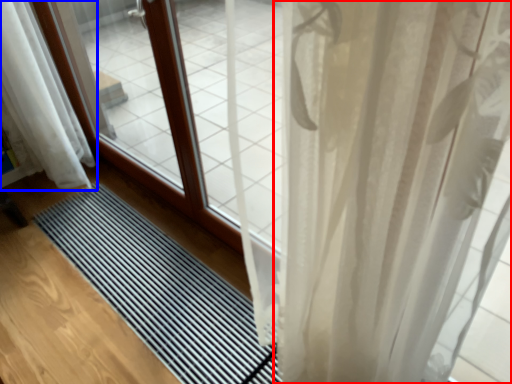
Question: Which object appears farthest to the camera in this image, curtain (highlighted by a red box) or curtain (highlighted by a blue box)?

Choices:
 (A) curtain
 (B) curtain

Answer: (B)